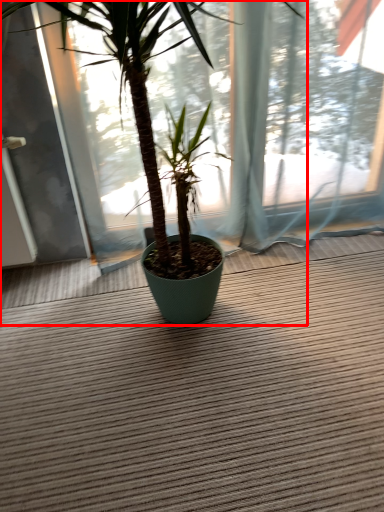
Question: From the image, what is the correct spatial relationship of houseplant (annotated by the red box) in relation to doormat?

Choices:
 (A) left
 (B) right

Answer: (A)